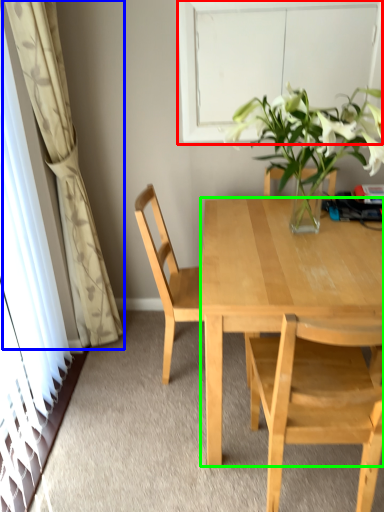
Question: Based on their relative distances, which object is farther from window (highlighted by a red box)? Choose from curtain (highlighted by a blue box) and desk (highlighted by a green box).

Choices:
 (A) curtain
 (B) desk

Answer: (A)